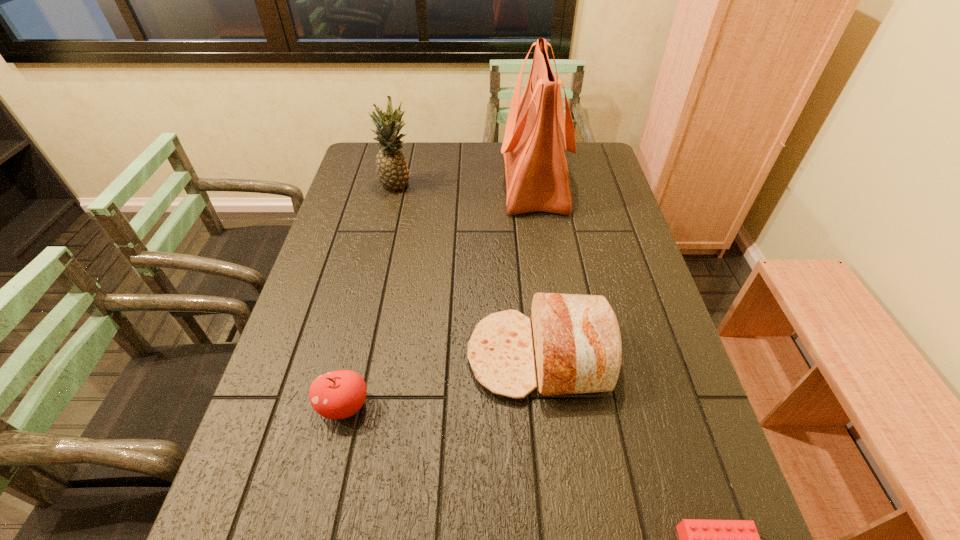
This screenshot has height=540, width=960. Find the location of `vacant space located 0.260m at the sliced end of the bread`. vacant space located 0.260m at the sliced end of the bread is located at coordinates (356, 356).

What are the coordinates of `free point located 0.280m on the back of the apple` in the screenshot? It's located at pos(371,292).

Where is `shopping bag that is at the far edge`? shopping bag that is at the far edge is located at coordinates (537, 132).

At what (x,y) coordinates should I click in order to perform the action: click on pineapple situated at the far edge. Please return your answer as a coordinate pair (x, y). Looking at the image, I should click on (393, 174).

Image resolution: width=960 pixels, height=540 pixels. What are the coordinates of `pineapple that is at the left edge` in the screenshot? It's located at (393, 174).

Where is `apple located in the left edge section of the desktop`? The width and height of the screenshot is (960, 540). apple located in the left edge section of the desktop is located at coordinates (340, 394).

Where is `shopping bag that is at the right edge`? shopping bag that is at the right edge is located at coordinates (537, 132).

Where is `bread that is positioned at the right edge`? The height and width of the screenshot is (540, 960). bread that is positioned at the right edge is located at coordinates point(577,343).

Where is `object present at the far left corner`? object present at the far left corner is located at coordinates (393, 174).

Where is `object positioned at the far right corner`? object positioned at the far right corner is located at coordinates (537, 132).